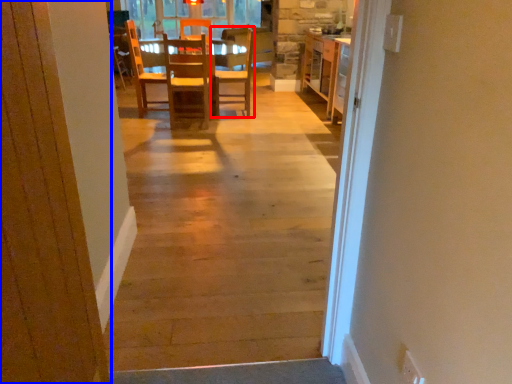
Question: Which object appears farthest to the camera in this image, chair (highlighted by a red box) or door (highlighted by a blue box)?

Choices:
 (A) chair
 (B) door

Answer: (A)